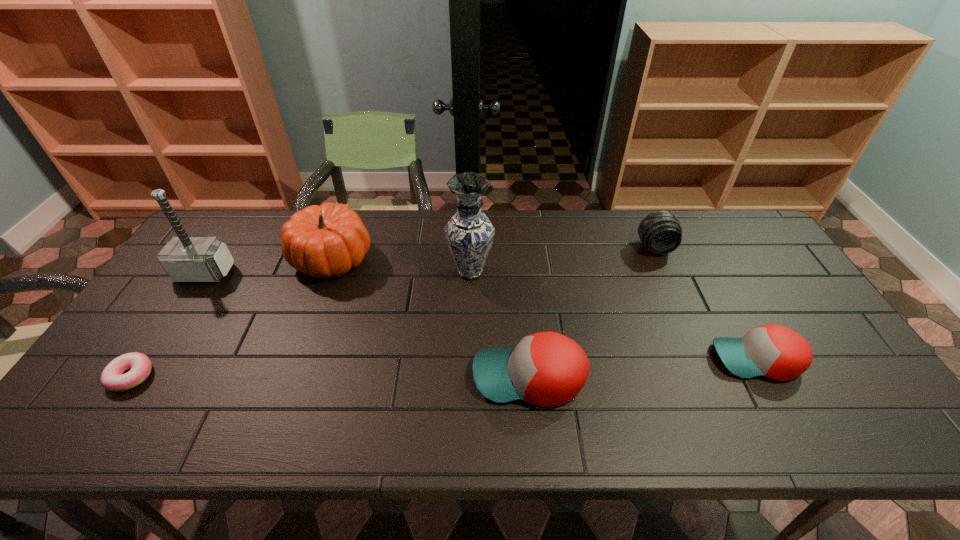
You are a GUI agent. You are given a task and a screenshot of the screen. Output one action in this format:
    pyautogui.click(x=<x>, y=<y>)
    Task: Click on the left baseball cap
    This screenshot has width=960, height=540.
    Given the screenshot: What is the action you would take?
    pyautogui.click(x=547, y=369)

Identify the location of the right baseball cap. (773, 351).

Where is `the shorter baseball cap`? Image resolution: width=960 pixels, height=540 pixels. the shorter baseball cap is located at coordinates (773, 351).

Locate an element on the screen. The height and width of the screenshot is (540, 960). telephoto lens is located at coordinates (660, 232).

Where is `the third object from left to right`? The height and width of the screenshot is (540, 960). the third object from left to right is located at coordinates (328, 240).

I want to click on pumpkin, so click(328, 240).

The height and width of the screenshot is (540, 960). What are the coordinates of `vase` in the screenshot? It's located at (469, 233).

Find the location of a particular element. The height and width of the screenshot is (540, 960). hammer is located at coordinates (185, 259).

Locate an element on the screen. This screenshot has width=960, height=540. the shortest object is located at coordinates (112, 378).

Where is `free region located 0.400m at the brim of the taller baseball cap`? The image size is (960, 540). free region located 0.400m at the brim of the taller baseball cap is located at coordinates (307, 377).